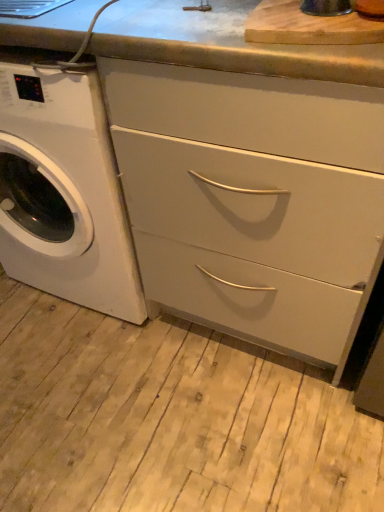
Question: From a real-world perspective, is wooden cutting board at upper center on top of matte white drawers at center?

Choices:
 (A) yes
 (B) no

Answer: (A)

Question: Does wooden cutting board at upper center appear on the left side of matte white drawers at center?

Choices:
 (A) yes
 (B) no

Answer: (A)

Question: Does wooden cutting board at upper center have a greater height compared to matte white drawers at center?

Choices:
 (A) yes
 (B) no

Answer: (B)

Question: Is wooden cutting board at upper center smaller than matte white drawers at center?

Choices:
 (A) yes
 (B) no

Answer: (A)

Question: Is wooden cutting board at upper center oriented towards matte white drawers at center?

Choices:
 (A) no
 (B) yes

Answer: (A)

Question: Is wooden cutting board at upper center in front of or behind white glossy washing machine at left in the image?

Choices:
 (A) behind
 (B) front

Answer: (B)

Question: Does point (286, 1) appear closer or farther from the camera than point (97, 292)?

Choices:
 (A) closer
 (B) farther

Answer: (A)

Question: Choose the correct answer: Is wooden cutting board at upper center inside white glossy washing machine at left or outside it?

Choices:
 (A) inside
 (B) outside

Answer: (B)

Question: From the image's perspective, relative to white glossy washing machine at left, is wooden cutting board at upper center above or below?

Choices:
 (A) above
 (B) below

Answer: (A)

Question: From the image's perspective, is wooden cutting board at upper center located above or below matte white drawers at center?

Choices:
 (A) below
 (B) above

Answer: (B)

Question: Would you say wooden cutting board at upper center is inside or outside matte white drawers at center?

Choices:
 (A) inside
 (B) outside

Answer: (B)

Question: Is wooden cutting board at upper center taller or shorter than matte white drawers at center?

Choices:
 (A) tall
 (B) short

Answer: (B)

Question: In the image, is wooden cutting board at upper center positioned in front of or behind matte white drawers at center?

Choices:
 (A) front
 (B) behind

Answer: (B)

Question: From their relative heights in the image, would you say matte white drawers at center is taller or shorter than wooden cutting board at upper center?

Choices:
 (A) tall
 (B) short

Answer: (A)

Question: In terms of width, does matte white drawers at center look wider or thinner when compared to wooden cutting board at upper center?

Choices:
 (A) wide
 (B) thin

Answer: (A)